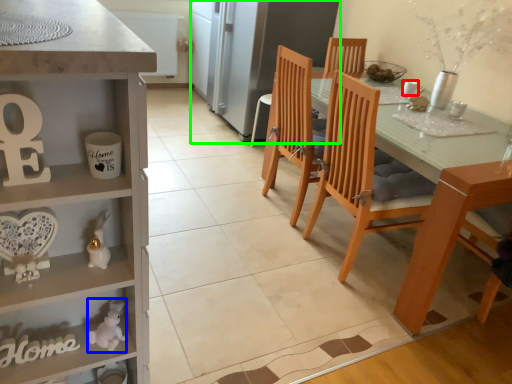
Question: Which object is positioned farthest from coffee cup (highlighted by a red box)? Select from toy (highlighted by a blue box) and fridge (highlighted by a green box).

Choices:
 (A) toy
 (B) fridge

Answer: (A)